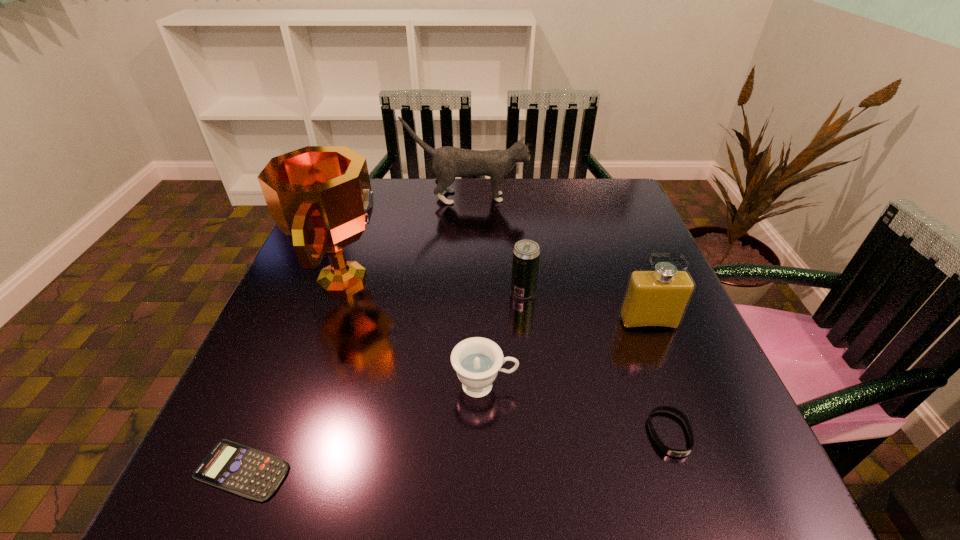
Where is `perfume that is at the right edge`? The image size is (960, 540). perfume that is at the right edge is located at coordinates (654, 299).

You are a GUI agent. You are given a task and a screenshot of the screen. Output one action in this format:
    pyautogui.click(x=<x>, y=<y>)
    Task: Click on the wristband that is at the right edge
    The width and height of the screenshot is (960, 540).
    Given the screenshot: What is the action you would take?
    pyautogui.click(x=665, y=449)

Where is `object situated at the near left corner`? Image resolution: width=960 pixels, height=540 pixels. object situated at the near left corner is located at coordinates (247, 472).

Find the location of a particular element. The image size is (960, 540). object that is at the near right corner is located at coordinates (665, 449).

Image resolution: width=960 pixels, height=540 pixels. Identify the location of vacant space at the far edge of the desktop. (482, 192).

In the image, there is a desktop. What are the coordinates of `vacant space at the near edge` in the screenshot? It's located at pyautogui.click(x=477, y=512).

The height and width of the screenshot is (540, 960). In the image, there is a desktop. Identify the location of vacant space at the left edge. (330, 335).

At what (x,y) coordinates should I click in order to perform the action: click on vacant area at the right edge. Please return your answer as a coordinate pair (x, y). Looking at the image, I should click on (662, 381).

Image resolution: width=960 pixels, height=540 pixels. Find the location of `unoccupied position between the farthest object and the beer can`. unoccupied position between the farthest object and the beer can is located at coordinates (495, 245).

Find the location of a particular element. This screenshot has height=540, width=960. free space between the fifth farthest object and the cat is located at coordinates point(476,292).